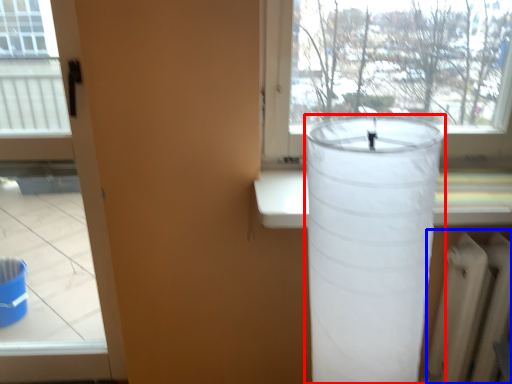
Question: Which of the following is the farthest to the observer, lamp (highlighted by a red box) or radiator (highlighted by a blue box)?

Choices:
 (A) lamp
 (B) radiator

Answer: (B)